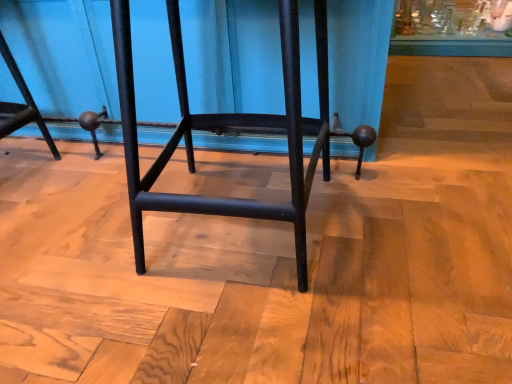
This screenshot has width=512, height=384. I want to click on empty space that is to the right of black matte metal chair at center, so click(422, 219).